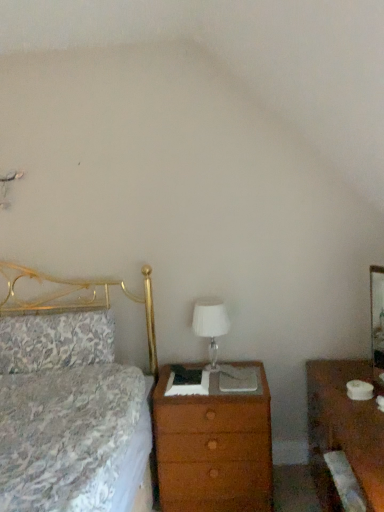
The height and width of the screenshot is (512, 384). I want to click on free spot above wooden chest of drawers at center (from a real-world perspective), so click(195, 378).